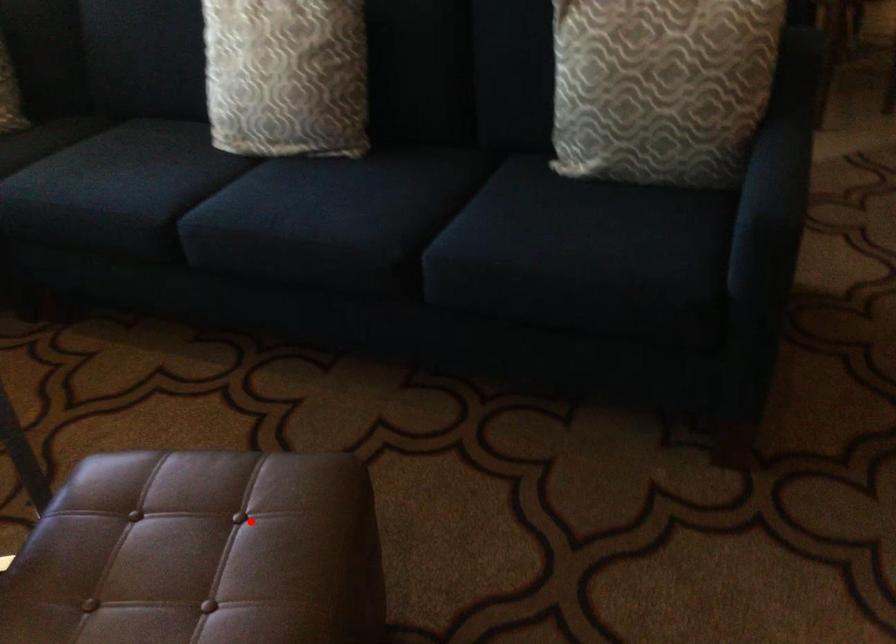
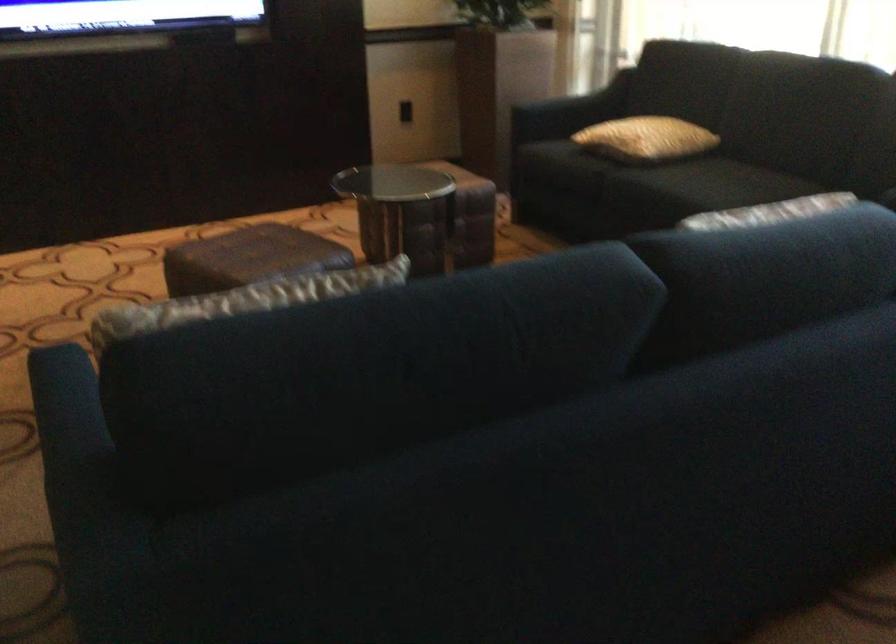
Question: I am providing you with two images of the same scene from different viewpoints. A red point is marked on the first image. Is the red point's position out of view in image 2?

Choices:
 (A) Yes
 (B) No

Answer: (B)